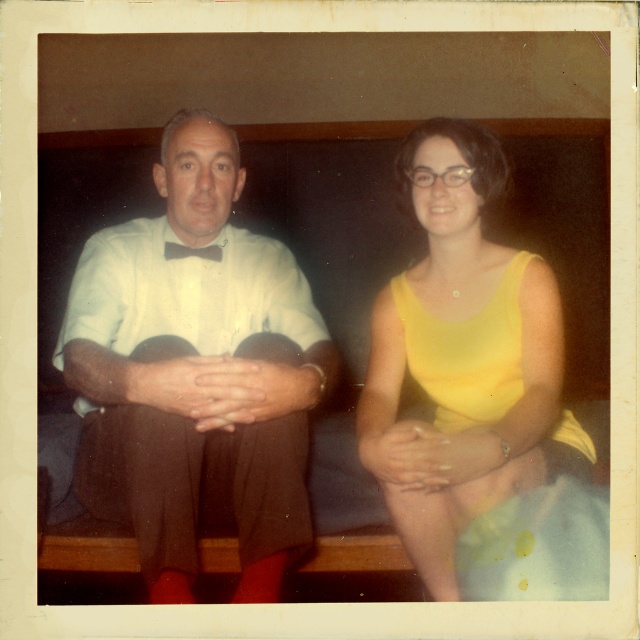
Question: Is matte white shirt at center behind yellow matte dress at center?

Choices:
 (A) yes
 (B) no

Answer: (A)

Question: Is matte white shirt at center to the right of yellow matte dress at center from the viewer's perspective?

Choices:
 (A) yes
 (B) no

Answer: (B)

Question: Which point is closer to the camera taking this photo?

Choices:
 (A) (484, 131)
 (B) (250, 593)

Answer: (B)

Question: Does matte white shirt at center appear on the right side of yellow matte dress at center?

Choices:
 (A) yes
 (B) no

Answer: (B)